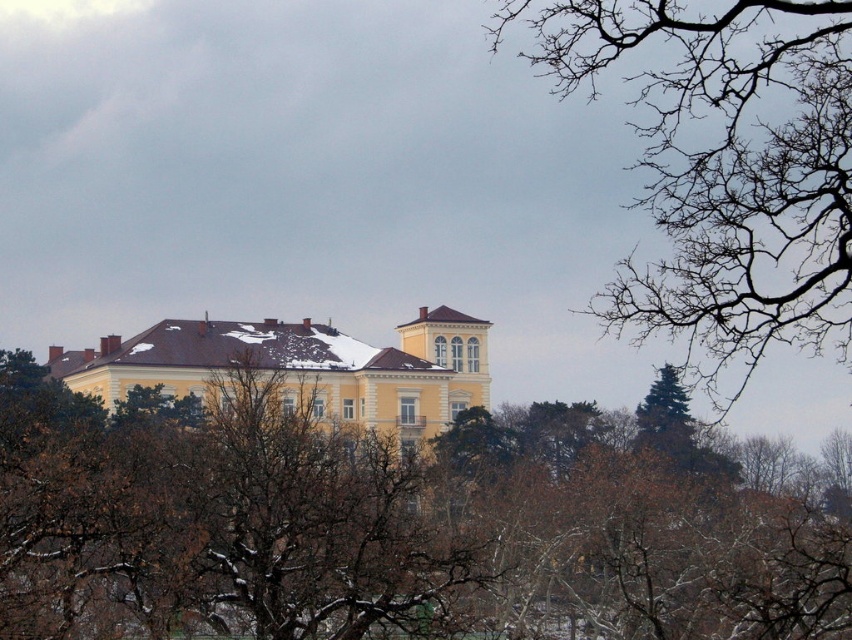
Does brown leafless branches at upper center appear over bare branches at upper right?

No.

Who is positioned more to the right, brown leafless branches at upper center or bare branches at upper right?

Positioned to the right is bare branches at upper right.

I want to click on brown leafless branches at upper center, so click(x=383, y=529).

Between brown leafless branches at upper center and yellow matte building at center, which one is positioned higher?

Positioned higher is yellow matte building at center.

Is brown leafless branches at upper center further to the viewer compared to yellow matte building at center?

No, brown leafless branches at upper center is in front of yellow matte building at center.

The image size is (852, 640). I want to click on brown leafless branches at upper center, so click(383, 529).

Which is more to the right, bare branches at upper right or yellow matte building at center?

From the viewer's perspective, bare branches at upper right appears more on the right side.

Can you confirm if bare branches at upper right is shorter than yellow matte building at center?

Incorrect, bare branches at upper right's height does not fall short of yellow matte building at center's.

Is point (606, 289) closer to viewer compared to point (346, 333)?

That is True.

The height and width of the screenshot is (640, 852). I want to click on bare branches at upper right, so click(724, 170).